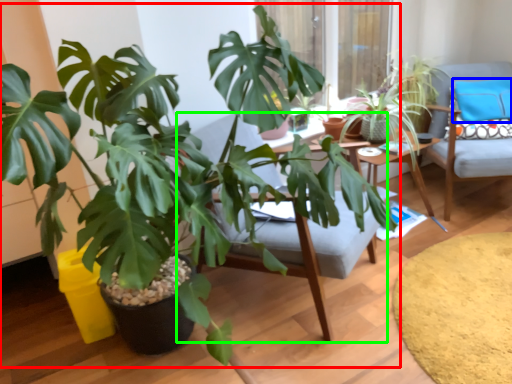
Question: Which object is positioned farthest from houseplant (highlighted by a red box)? Select from pillow (highlighted by a blue box) and swivel chair (highlighted by a green box).

Choices:
 (A) pillow
 (B) swivel chair

Answer: (A)